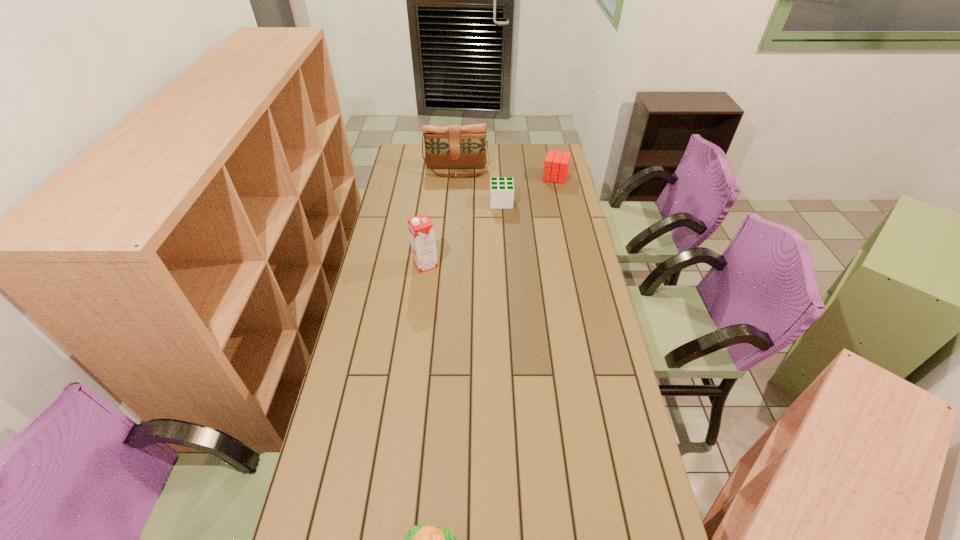
The height and width of the screenshot is (540, 960). Find the location of `blank space that satisfies the following two spatial constraints: 1. on the front side of the right cube; 2. on the red face of the third nearest object`. blank space that satisfies the following two spatial constraints: 1. on the front side of the right cube; 2. on the red face of the third nearest object is located at coordinates (561, 202).